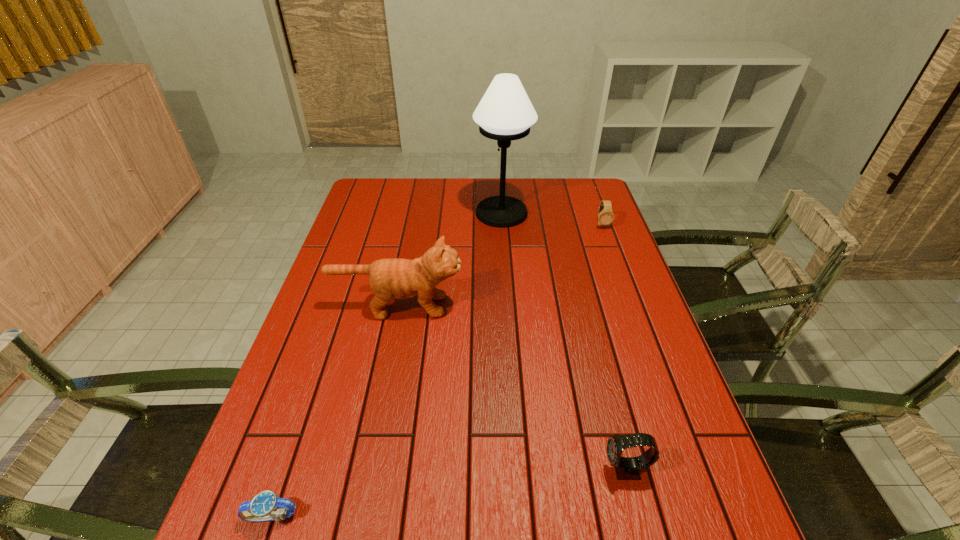
What are the coordinates of `vacant space that is in between the cat and the third shortest object` in the screenshot? It's located at pyautogui.click(x=512, y=388).

Locate an element on the screen. The width and height of the screenshot is (960, 540). vacant region between the table lamp and the nearest watch is located at coordinates (387, 365).

Identify the location of unoccupied position between the tallest watch and the second tallest watch. (613, 347).

The width and height of the screenshot is (960, 540). In order to click on free spot between the leftmost watch and the third tallest object in this screenshot , I will do `click(449, 494)`.

You are a GUI agent. You are given a task and a screenshot of the screen. Output one action in this format:
    pyautogui.click(x=<x>, y=<y>)
    Task: Click on the empty space that is in between the second shortest watch and the shortest object
    This screenshot has width=960, height=540.
    Given the screenshot: What is the action you would take?
    pyautogui.click(x=437, y=371)

Identify which object is the third nearest to the second object from right to left. Please provide its 2D coordinates. Your answer should be formatted as a tuple, i.e. [(x, y)], where the tuple contains the x and y coordinates of a point satisfying the conditions above.

[(606, 216)]

Identify the location of object that is the closest to the fourth farthest object. (396, 278).

At what (x,y) coordinates should I click in order to perform the action: click on the closest watch to the second nearest watch. Please return your answer as a coordinate pair (x, y). Looking at the image, I should click on (260, 508).

At what (x,y) coordinates should I click in order to perform the action: click on watch that is the third nearest to the third nearest object. Please return your answer as a coordinate pair (x, y). Image resolution: width=960 pixels, height=540 pixels. Looking at the image, I should click on (606, 216).

Identify the location of blank space that satisfies the following two spatial constraints: 1. on the face of the rightmost watch; 2. on the face of the second nearest object. (692, 470).